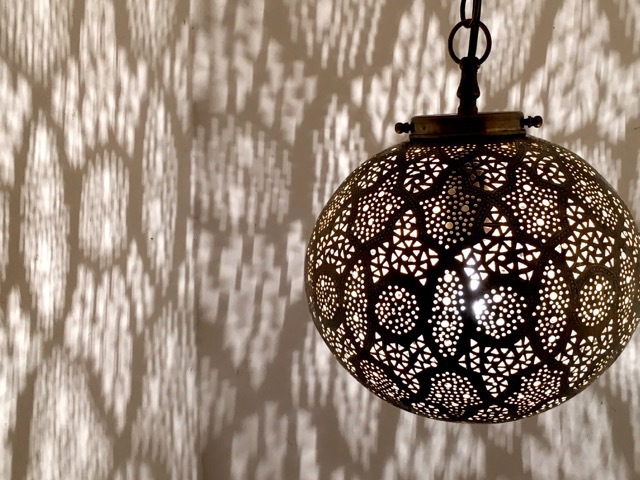
Identify the location of socket for bulb. Image resolution: width=640 pixels, height=480 pixels. (463, 208).